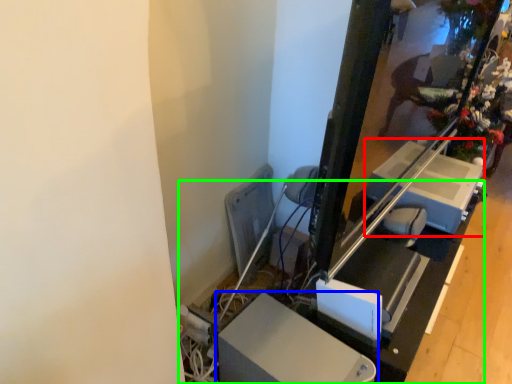
Question: Which object is the farthest from lift (highlighted by a red box)? Choose among these: furniture (highlighted by a blue box) or table (highlighted by a green box).

Choices:
 (A) furniture
 (B) table

Answer: (A)